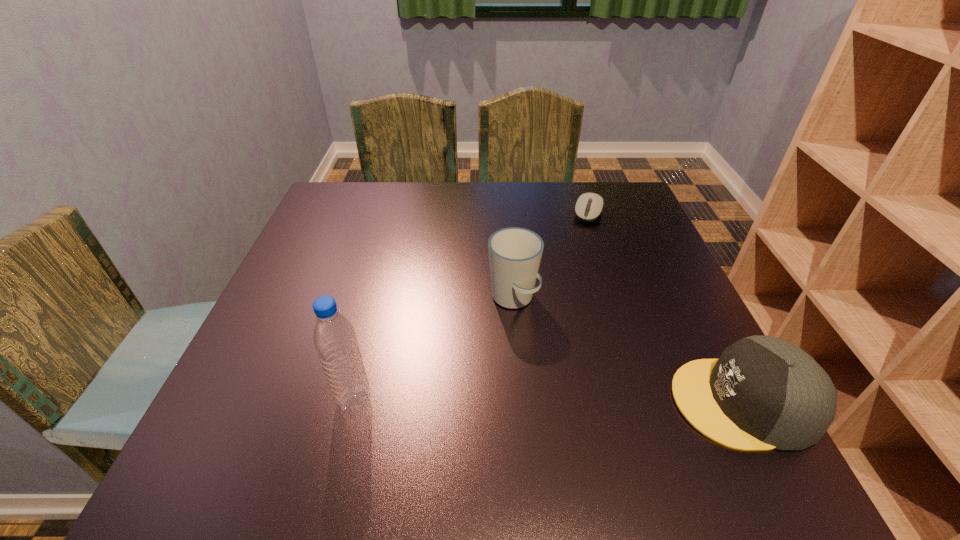
Where is `cap situated at the right edge`? The image size is (960, 540). cap situated at the right edge is located at coordinates (x=763, y=392).

Identify the location of computer equipment that is at the right edge. Image resolution: width=960 pixels, height=540 pixels. (589, 206).

Locate an element on the screen. object at the far right corner is located at coordinates (589, 206).

The width and height of the screenshot is (960, 540). In order to click on object present at the near right corner in this screenshot , I will do `click(763, 392)`.

Find the location of a particular element. The height and width of the screenshot is (540, 960). free space at the far edge of the desktop is located at coordinates (417, 226).

Image resolution: width=960 pixels, height=540 pixels. In the image, there is a desktop. What are the coordinates of `free space at the near edge` in the screenshot? It's located at (384, 409).

The image size is (960, 540). In the image, there is a desktop. Identify the location of blank space at the left edge. (332, 245).

This screenshot has width=960, height=540. What are the coordinates of `vacant space at the right edge of the desktop` in the screenshot? It's located at (691, 308).

The image size is (960, 540). In the image, there is a desktop. Find the location of `vacant space at the near left corner`. vacant space at the near left corner is located at coordinates (247, 398).

In the image, there is a desktop. What are the coordinates of `vacant area at the far right corner` in the screenshot? It's located at pyautogui.click(x=634, y=195).